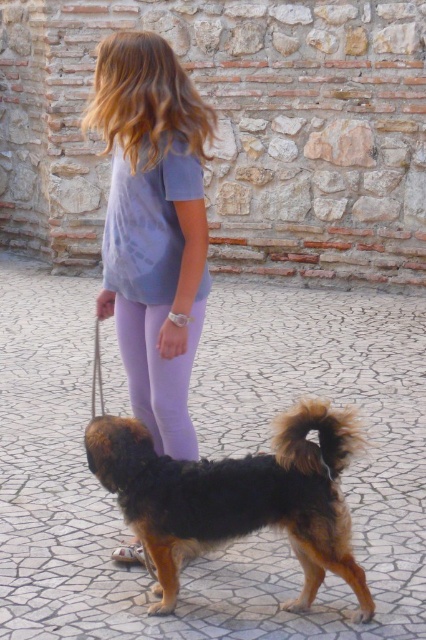
You are a photographer standing at the center of the image. You want to take a photo of the brown fur dog at lower center. Based on the coordinates provided, where should you position your camera to ensure the dog is centered in the frame?

The brown fur dog at lower center is located at coordinates point (236, 497). To center the dog in the frame, the photographer should position the camera so that the center of the frame aligns with these coordinates.

You are a photographer trying to capture a photo of the brown fur dog at lower center and the purple leggings at center. What is the minimum distance you need to maintain between the camera and the subject to ensure both are in focus?

The minimum distance you need to maintain between the camera and the subject to ensure both the brown fur dog at lower center and the purple leggings at center are in focus is 54.04 centimeters.

You are a fashion designer observing the image. You need to decide which item, the purple cotton shirt at upper center or the brown fur dog at lower center, requires more fabric to make. Which one would you choose?

The purple cotton shirt at upper center is bigger than the brown fur dog at lower center, so it requires more fabric to make.